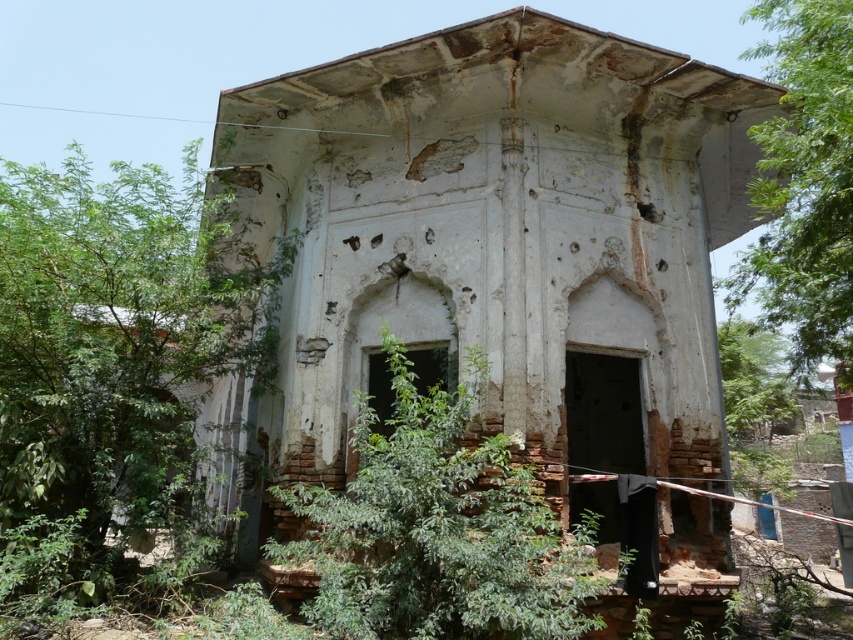
You are a painter wanting to capture the white weathered wall at center and the green leafy tree at left in your painting. Which object should you focus on to ensure it stands out more in terms of size?

The green leafy tree at left is larger than the white weathered wall at center, so focusing on it will make it stand out more in terms of size.